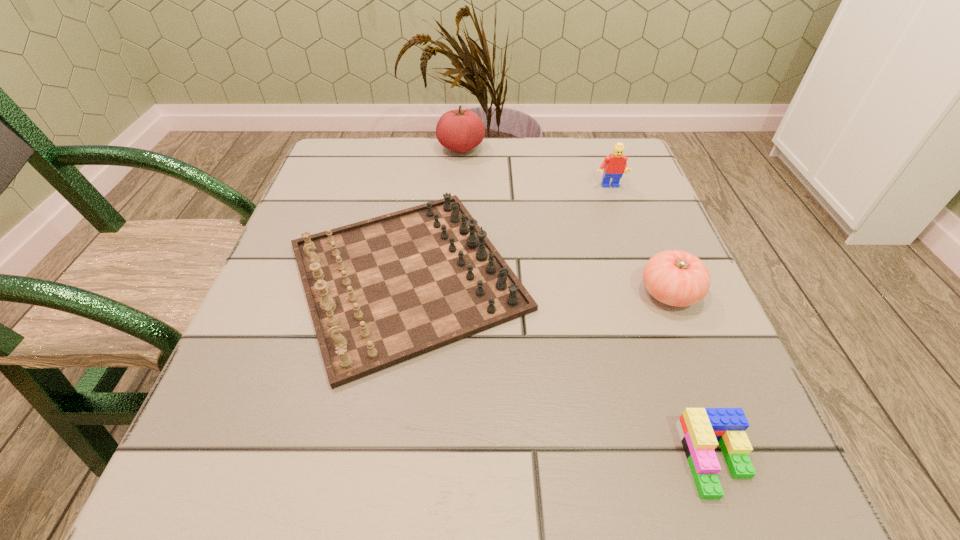
Identify the location of free space between the taller Lego and the chessboard. (508, 231).

Locate an element on the screen. empty location between the nearer Lego and the farther tomato is located at coordinates (588, 304).

This screenshot has width=960, height=540. Find the location of `free area in between the taller Lego and the shorter tomato`. free area in between the taller Lego and the shorter tomato is located at coordinates (639, 240).

Where is `free space between the chessboard and the shortest object`? free space between the chessboard and the shortest object is located at coordinates (561, 367).

Image resolution: width=960 pixels, height=540 pixels. In order to click on free spot between the farther Lego and the shorter tomato in this screenshot , I will do `click(639, 240)`.

Image resolution: width=960 pixels, height=540 pixels. Identify the location of empty location between the chessboard and the farther Lego. (508, 231).

Locate an element on the screen. empty space between the nearest object and the chessboard is located at coordinates (561, 367).

At what (x,y) coordinates should I click in order to perform the action: click on free space between the shortest object and the shorter tomato. Please return your answer as a coordinate pair (x, y). Looking at the image, I should click on (692, 376).

Locate an element on the screen. free space between the chessboard and the shorter Lego is located at coordinates (561, 367).

The width and height of the screenshot is (960, 540). I want to click on object that stands as the closest to the shorter Lego, so click(381, 291).